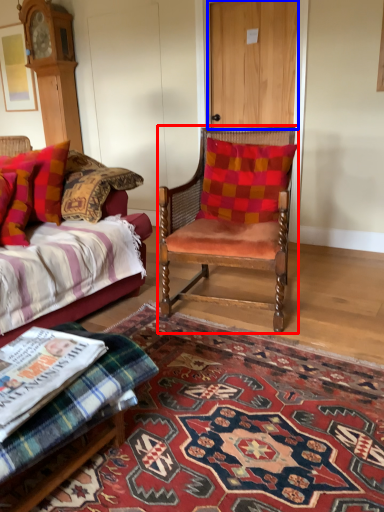
Question: Which point is further to the camera, chair (highlighted by a red box) or door (highlighted by a blue box)?

Choices:
 (A) chair
 (B) door

Answer: (B)